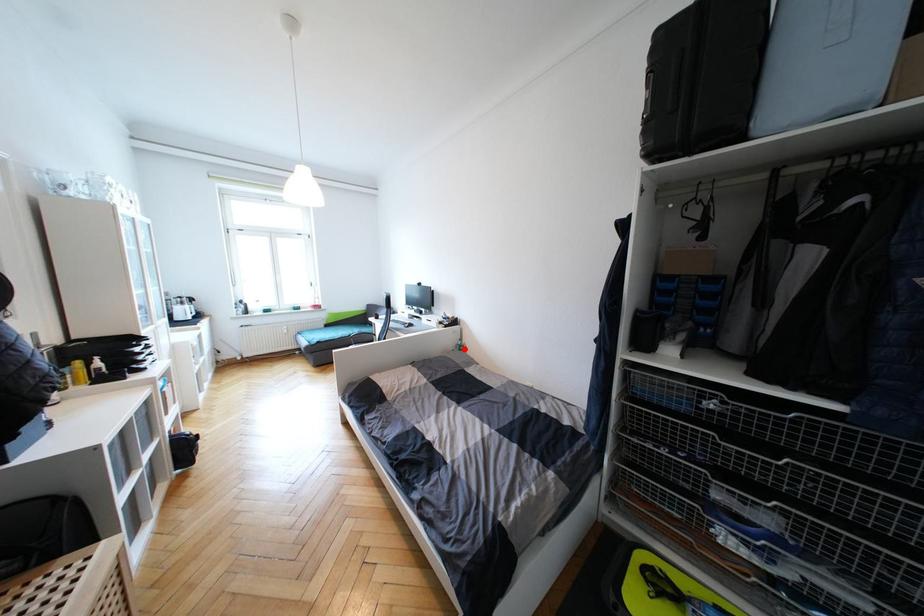
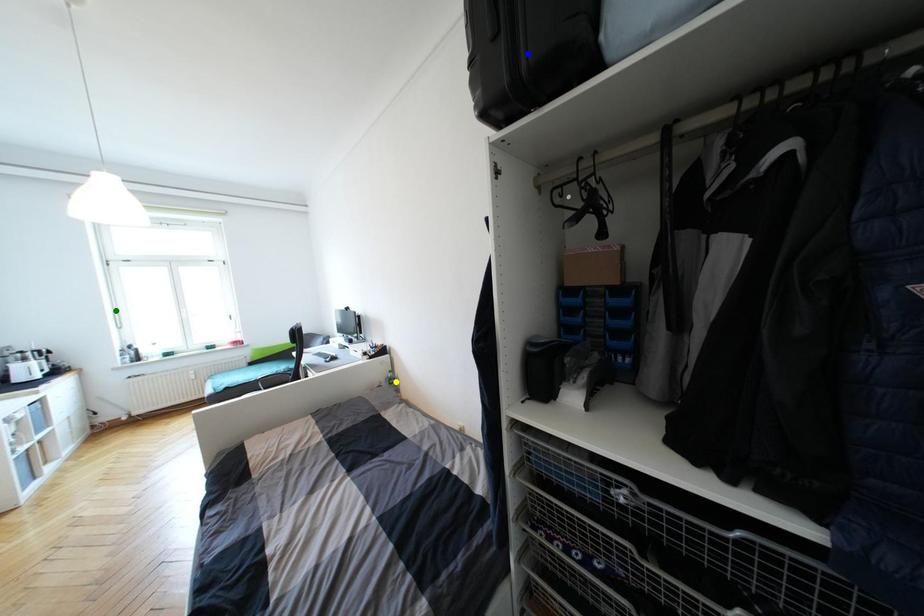
Question: I am providing you with two images of the same scene from different viewpoints. A red point is marked on the first image. You are given multiple points on the second image. Can you choose the point in image 2 that corresponds to the point in image 1?

Choices:
 (A) yellow point
 (B) green point
 (C) blue point

Answer: (A)